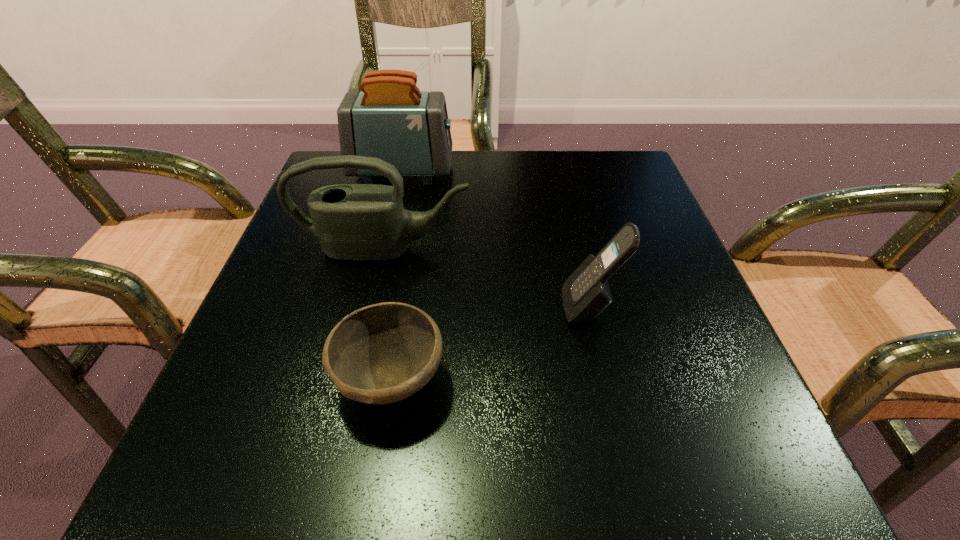
Locate an element on the screen. The width and height of the screenshot is (960, 540). toaster is located at coordinates (391, 119).

At what (x,y) coordinates should I click in order to perform the action: click on watering can. Please return your answer as a coordinate pair (x, y). Looking at the image, I should click on (362, 222).

At what (x,y) coordinates should I click in order to perform the action: click on the rightmost object. Please return your answer as a coordinate pair (x, y). Looking at the image, I should click on (586, 293).

Where is `the second nearest object`? The image size is (960, 540). the second nearest object is located at coordinates (586, 293).

Identify the location of the shortest object. (382, 353).

The image size is (960, 540). In order to click on the nearest object in this screenshot , I will do `click(382, 353)`.

Image resolution: width=960 pixels, height=540 pixels. I want to click on vacant region located 0.300m on the front-facing side of the farthest object, so click(x=581, y=172).

This screenshot has height=540, width=960. In order to click on vacant space located 0.170m on the spout of the watering can in this screenshot , I will do `click(364, 336)`.

This screenshot has width=960, height=540. Identify the location of blank space located 0.320m on the front-facing side of the third farthest object. (372, 306).

This screenshot has width=960, height=540. In order to click on vacant region located 0.240m on the front-facing side of the third farthest object in this screenshot , I will do `click(420, 306)`.